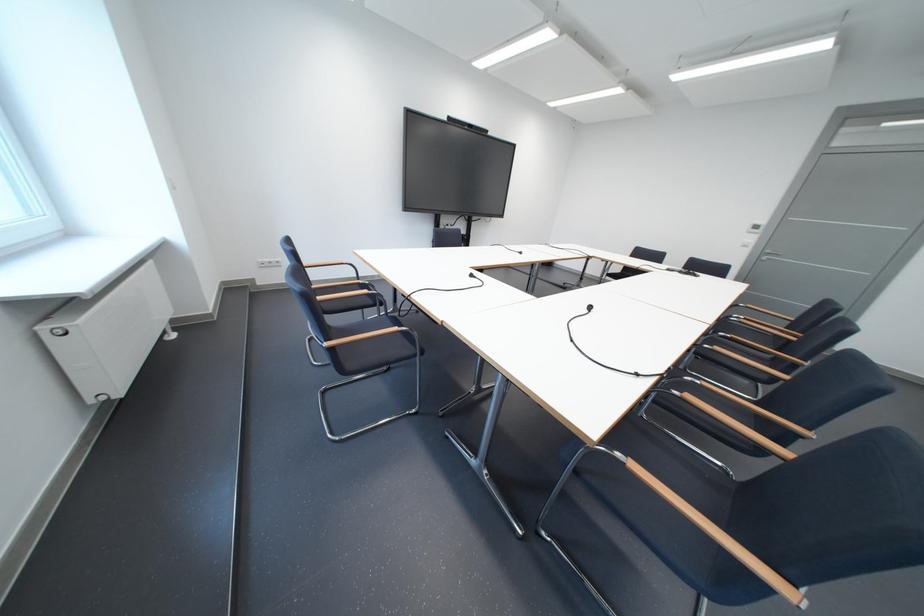
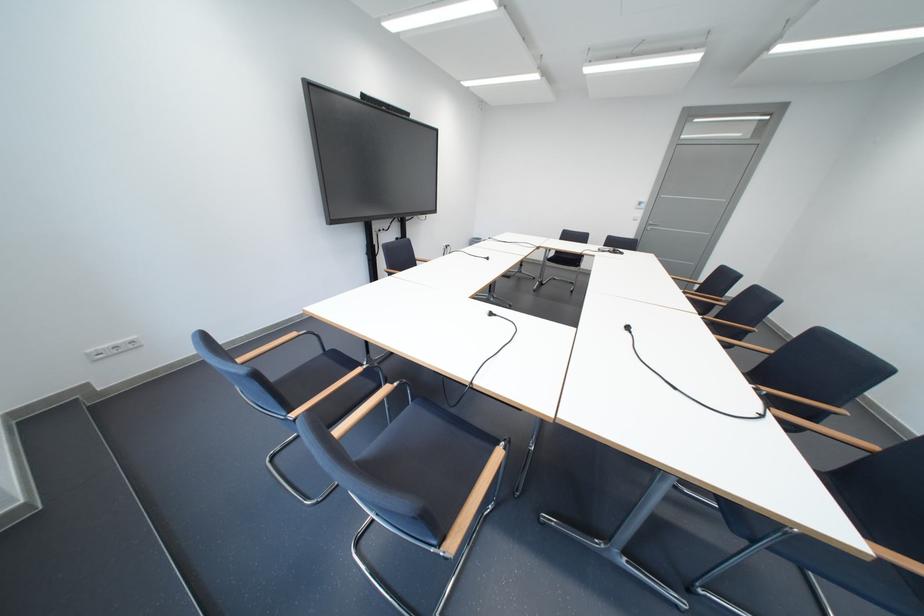
Where in the second image is the point corresponding to the point at 483,277 from the first image?

(503, 315)